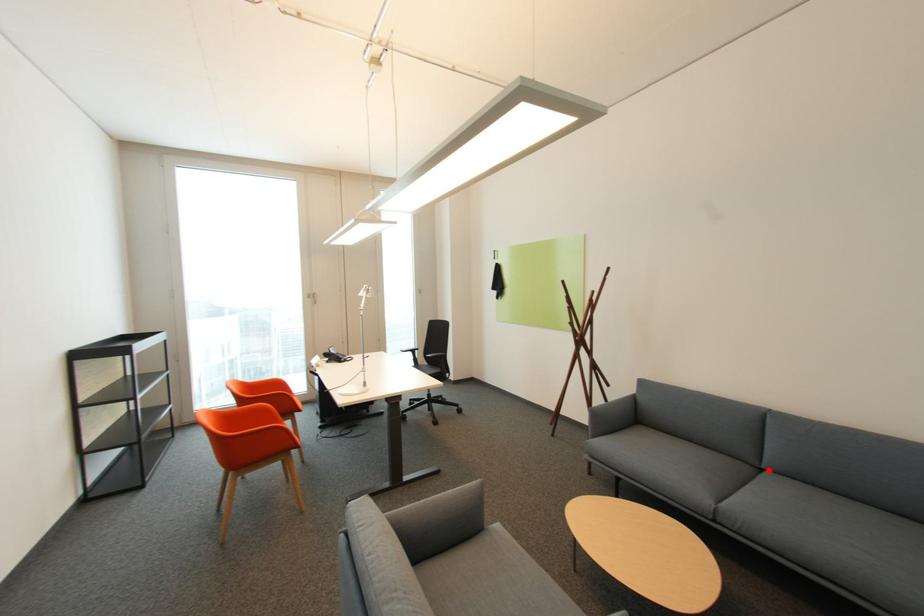
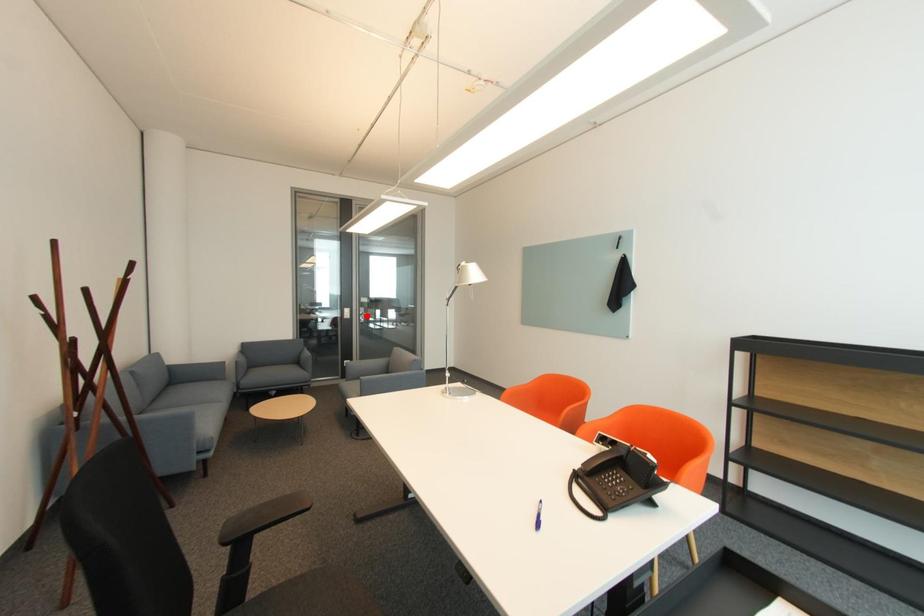
I am providing you with two images of the same scene from different viewpoints. A red point is marked on the first image and another point is marked on the second image. Is the red point in image1 aligned with the point shown in image2?

No